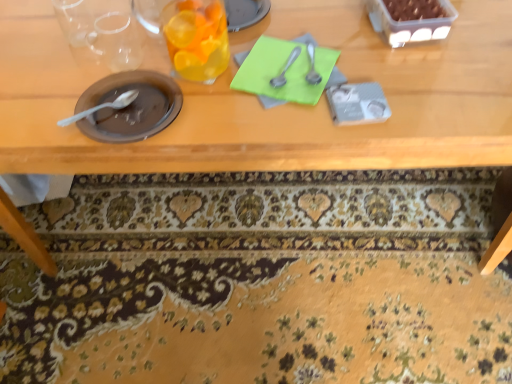
Locate an element on the screen. vacant area located to the right-hand side of satin silver spoon at upper center, the 4th tableware when ordered from left to right is located at coordinates (399, 67).